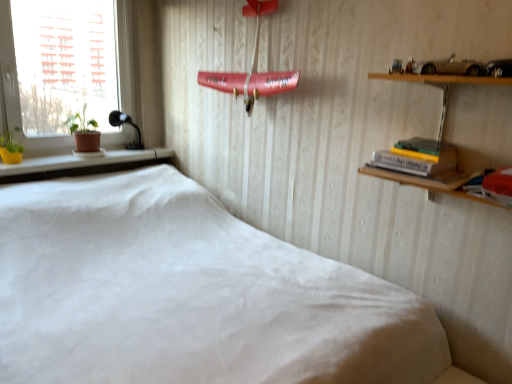
Question: Can you confirm if white plastic window at left is bigger than hardcover book at upper right, the second book viewed from the front?

Choices:
 (A) yes
 (B) no

Answer: (A)

Question: From the image's perspective, does white plastic window at left appear higher than hardcover book at upper right, the 1th book viewed from the back?

Choices:
 (A) no
 (B) yes

Answer: (B)

Question: Considering the relative sizes of white plastic window at left and hardcover book at upper right, which is counted as the 1th book, starting from the left, in the image provided, is white plastic window at left smaller than hardcover book at upper right, which is counted as the 1th book, starting from the left,?

Choices:
 (A) yes
 (B) no

Answer: (B)

Question: Considering the relative sizes of white plastic window at left and hardcover book at upper right, the second book viewed from the front, in the image provided, is white plastic window at left wider than hardcover book at upper right, the second book viewed from the front,?

Choices:
 (A) yes
 (B) no

Answer: (B)

Question: Considering the relative sizes of white plastic window at left and hardcover book at upper right, the 1th book viewed from the back, in the image provided, is white plastic window at left shorter than hardcover book at upper right, the 1th book viewed from the back,?

Choices:
 (A) no
 (B) yes

Answer: (A)

Question: Does white plastic window at left lie behind hardcover book at upper right, the second book viewed from the front?

Choices:
 (A) no
 (B) yes

Answer: (B)

Question: Is yellow matte flower pot at left placed right next to yellow matte plant at left?

Choices:
 (A) no
 (B) yes

Answer: (A)

Question: From a real-world perspective, is yellow matte flower pot at left over yellow matte plant at left?

Choices:
 (A) no
 (B) yes

Answer: (A)

Question: From the image's perspective, is yellow matte flower pot at left above yellow matte plant at left?

Choices:
 (A) yes
 (B) no

Answer: (B)

Question: Is yellow matte flower pot at left located outside yellow matte plant at left?

Choices:
 (A) no
 (B) yes

Answer: (B)

Question: Considering the relative sizes of yellow matte flower pot at left and yellow matte plant at left in the image provided, is yellow matte flower pot at left thinner than yellow matte plant at left?

Choices:
 (A) yes
 (B) no

Answer: (B)

Question: Considering the relative sizes of yellow matte flower pot at left and yellow matte plant at left in the image provided, is yellow matte flower pot at left wider than yellow matte plant at left?

Choices:
 (A) no
 (B) yes

Answer: (B)

Question: From the image's perspective, is white fabric bed at center below hardcover book at upper right, the 1th book viewed from the back?

Choices:
 (A) yes
 (B) no

Answer: (A)